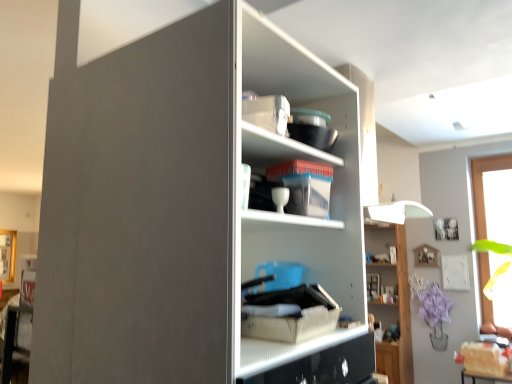
Question: Can you confirm if wooden shelf at upper right, which is the second shelf from left to right, is positioned to the left of matte gray cupboard at center?

Choices:
 (A) no
 (B) yes

Answer: (A)

Question: Is wooden shelf at upper right, which is the second shelf from left to right, turned away from matte gray cupboard at center?

Choices:
 (A) no
 (B) yes

Answer: (A)

Question: From a real-world perspective, is wooden shelf at upper right, arranged as the 1th shelf when viewed from the back, located beneath matte gray cupboard at center?

Choices:
 (A) yes
 (B) no

Answer: (A)

Question: Does wooden shelf at upper right, the first shelf viewed from the right, contain matte gray cupboard at center?

Choices:
 (A) no
 (B) yes

Answer: (A)

Question: Does wooden shelf at upper right, placed as the 2th shelf when sorted from top to bottom, have a lesser height compared to matte gray cupboard at center?

Choices:
 (A) no
 (B) yes

Answer: (A)

Question: In terms of height, does matte white cabinet at center look taller or shorter compared to transparent glass window at right?

Choices:
 (A) tall
 (B) short

Answer: (B)

Question: In terms of width, does matte white cabinet at center look wider or thinner when compared to transparent glass window at right?

Choices:
 (A) wide
 (B) thin

Answer: (B)

Question: Is matte white cabinet at center in front of or behind transparent glass window at right in the image?

Choices:
 (A) behind
 (B) front

Answer: (A)

Question: From the image's perspective, is matte white cabinet at center located above or below transparent glass window at right?

Choices:
 (A) above
 (B) below

Answer: (A)

Question: In terms of height, does transparent glass window at right look taller or shorter compared to matte white cabinet at center?

Choices:
 (A) short
 (B) tall

Answer: (B)

Question: In the image, is transparent glass window at right positioned in front of or behind matte white cabinet at center?

Choices:
 (A) front
 (B) behind

Answer: (A)

Question: Is transparent glass window at right bigger or smaller than matte white cabinet at center?

Choices:
 (A) big
 (B) small

Answer: (A)

Question: From a real-world perspective, is transparent glass window at right physically located above or below matte white cabinet at center?

Choices:
 (A) below
 (B) above

Answer: (A)

Question: Based on their sizes in the image, would you say wooden shelf at upper right, the first shelf viewed from the right, is bigger or smaller than matte cardboard box at center?

Choices:
 (A) small
 (B) big

Answer: (B)

Question: Considering the positions of wooden shelf at upper right, placed as the 2th shelf when sorted from top to bottom, and matte cardboard box at center in the image, is wooden shelf at upper right, placed as the 2th shelf when sorted from top to bottom, taller or shorter than matte cardboard box at center?

Choices:
 (A) short
 (B) tall

Answer: (B)